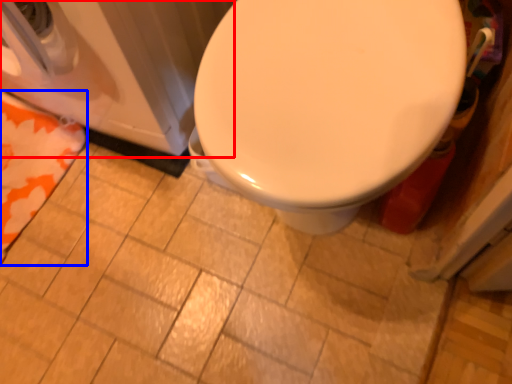
Question: Which of the following is the closest to the observer, washer (highlighted by a red box) or beach towel (highlighted by a blue box)?

Choices:
 (A) washer
 (B) beach towel

Answer: (A)